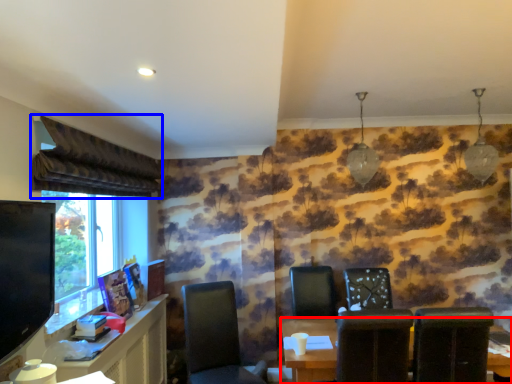
Question: Which point is closer to the camera, table (highlighted by a red box) or curtain (highlighted by a blue box)?

Choices:
 (A) table
 (B) curtain

Answer: (B)